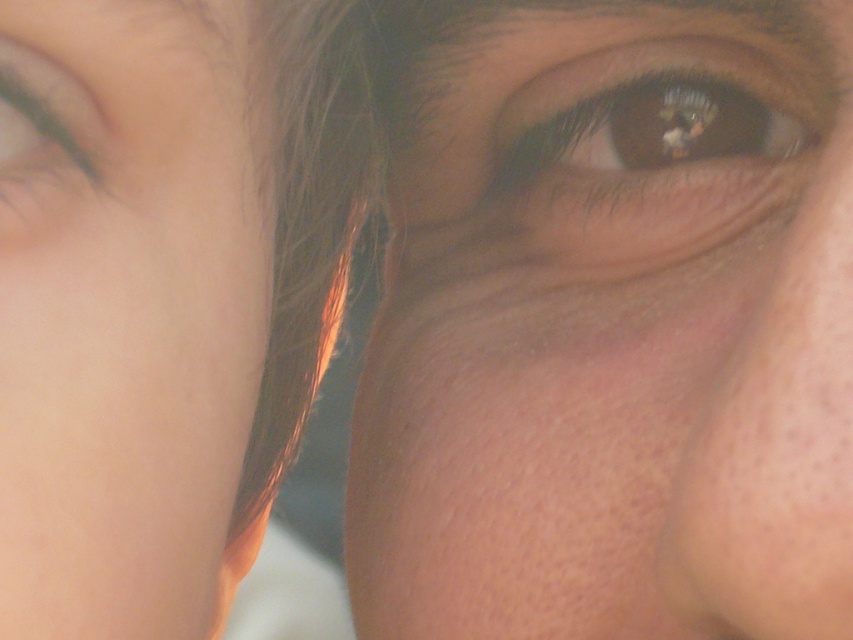
Question: Is brown matte eye at upper center positioned before brown matte eye at upper left?

Choices:
 (A) yes
 (B) no

Answer: (B)

Question: Which point is closer to the camera taking this photo?

Choices:
 (A) (630, 76)
 (B) (196, 275)

Answer: (B)

Question: Can you confirm if smooth skin eye at center is thinner than brown matte eye at upper center?

Choices:
 (A) yes
 (B) no

Answer: (B)

Question: Is smooth skin eye at center below smooth skin at left?

Choices:
 (A) no
 (B) yes

Answer: (A)

Question: Which object is positioned closest to the brown matte eye at upper center?

Choices:
 (A) brown matte eye at upper left
 (B) smooth skin at left

Answer: (B)

Question: Which of the following is the closest to the observer?

Choices:
 (A) smooth skin at left
 (B) brown matte eye at upper left

Answer: (A)